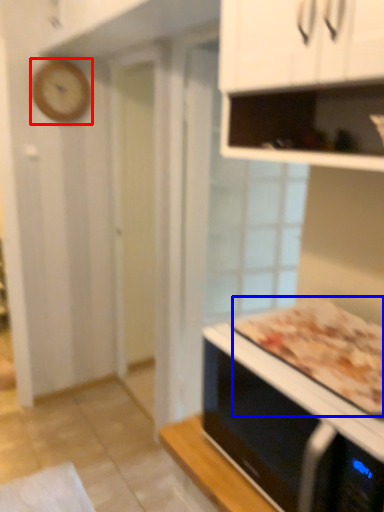
Question: Which point is further to the camera, clock (highlighted by a red box) or pizza (highlighted by a blue box)?

Choices:
 (A) clock
 (B) pizza

Answer: (A)